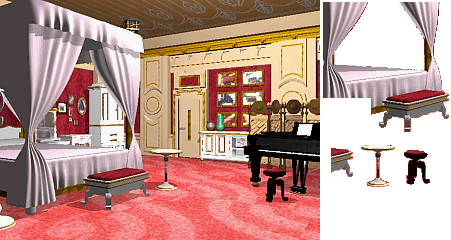
Locate an element on the screen. Image resolution: width=451 pixels, height=240 pixels. bed is located at coordinates (64, 157).